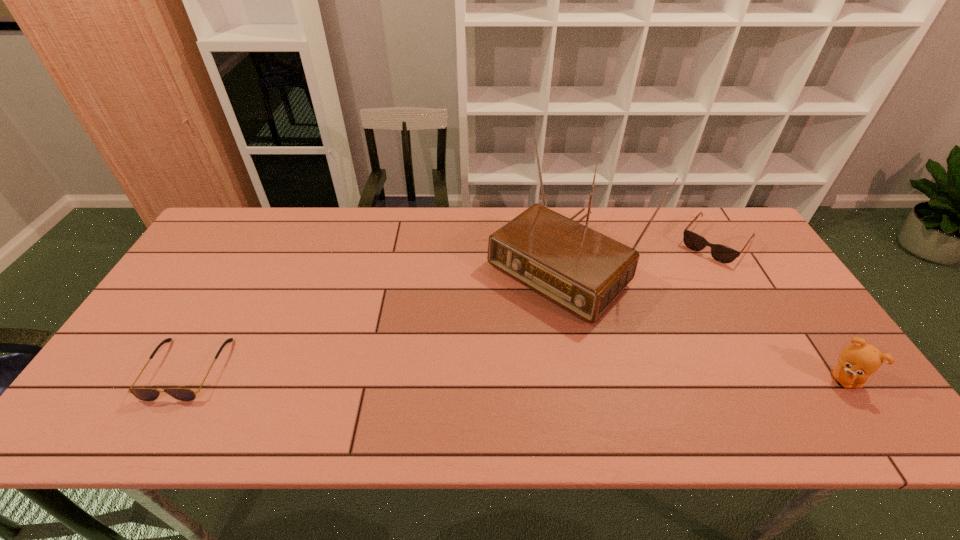
Image resolution: width=960 pixels, height=540 pixels. I want to click on object situated at the far right corner, so click(x=721, y=253).

Locate an element on the screen. object at the near right corner is located at coordinates (858, 361).

This screenshot has width=960, height=540. In the image, there is a desktop. What are the coordinates of `free region at the far edge` in the screenshot? It's located at (329, 208).

The width and height of the screenshot is (960, 540). Identify the location of vacant space at the near edge. (558, 374).

The width and height of the screenshot is (960, 540). Identify the location of vacant space at the far left corner of the desktop. (224, 228).

In order to click on vacant space at the far right corner of the desktop in this screenshot , I will do `click(724, 219)`.

Locate an element on the screen. This screenshot has height=540, width=960. vacant area that lies between the radio_receiver and the nearer sunglasses is located at coordinates [373, 314].

Image resolution: width=960 pixels, height=540 pixels. I want to click on free point between the second tallest object and the farther sunglasses, so click(780, 310).

Locate an element on the screen. The image size is (960, 540). vacant region between the teddy bear and the farther sunglasses is located at coordinates (780, 310).

You are a GUI agent. You are given a task and a screenshot of the screen. Output one action in this format:
    pyautogui.click(x=<x>, y=<y>)
    Task: Click on the vacant area between the right sunglasses and the left sunglasses
    
    Given the screenshot: What is the action you would take?
    pyautogui.click(x=451, y=305)